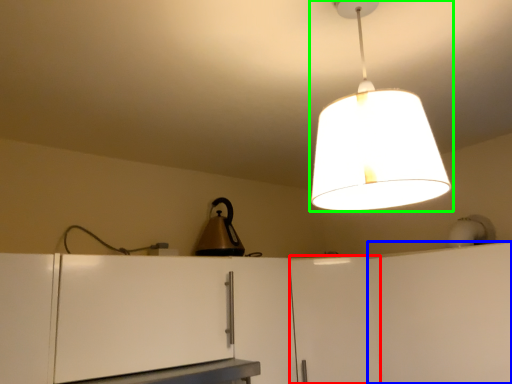
Question: Which object is the farthest from cabinetry (highlighted by a red box)? Choose among these: cabinetry (highlighted by a blue box) or lamp (highlighted by a green box).

Choices:
 (A) cabinetry
 (B) lamp

Answer: (B)